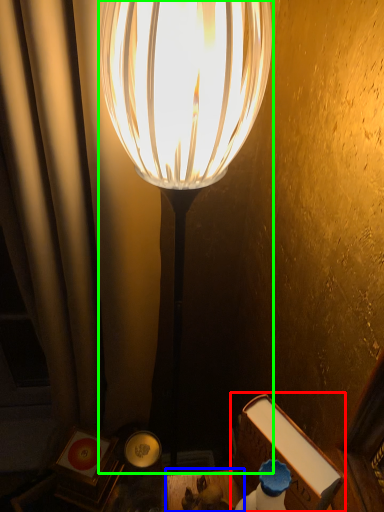
Question: Estimate the real-world distances between objects in this image. Which object is closer to book (highlighted by a red box), table (highlighted by a blue box) or lamp (highlighted by a green box)?

Choices:
 (A) table
 (B) lamp

Answer: (A)